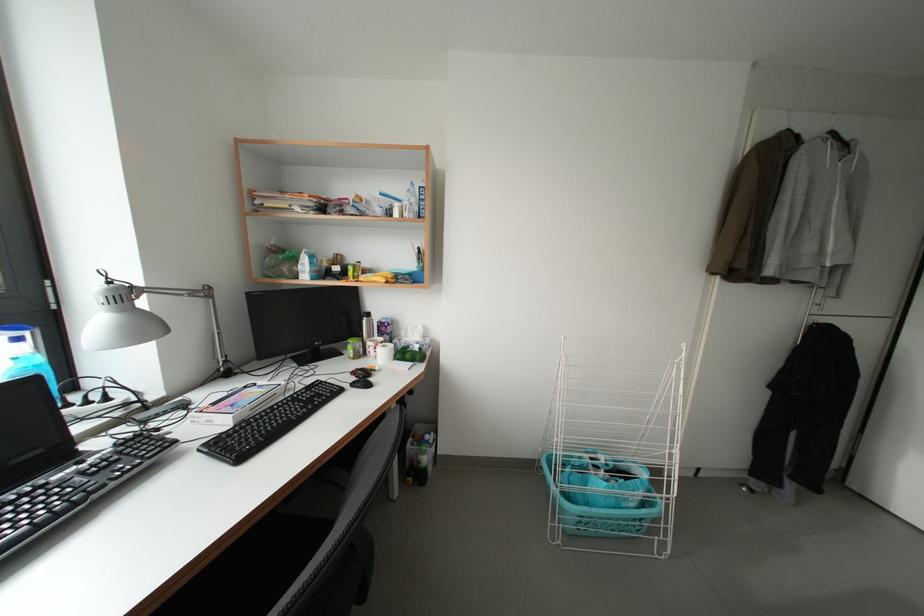
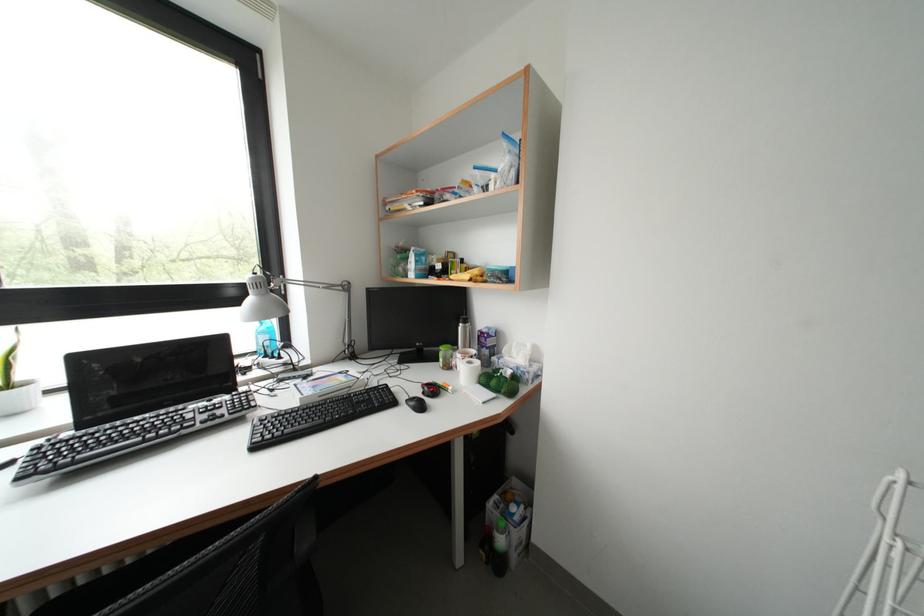
Locate, in the second image, the point that corresponds to point 388,347 in the first image.

(479, 362)